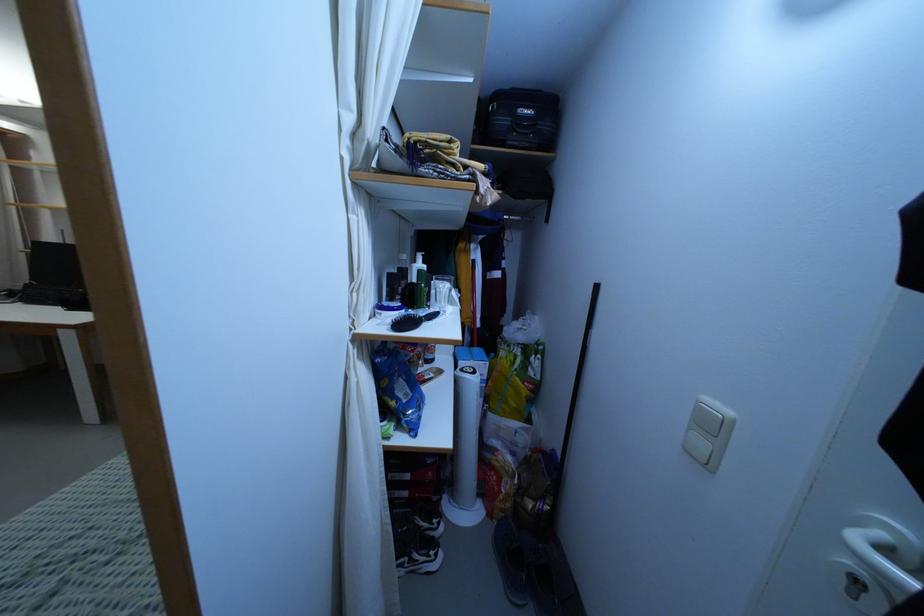
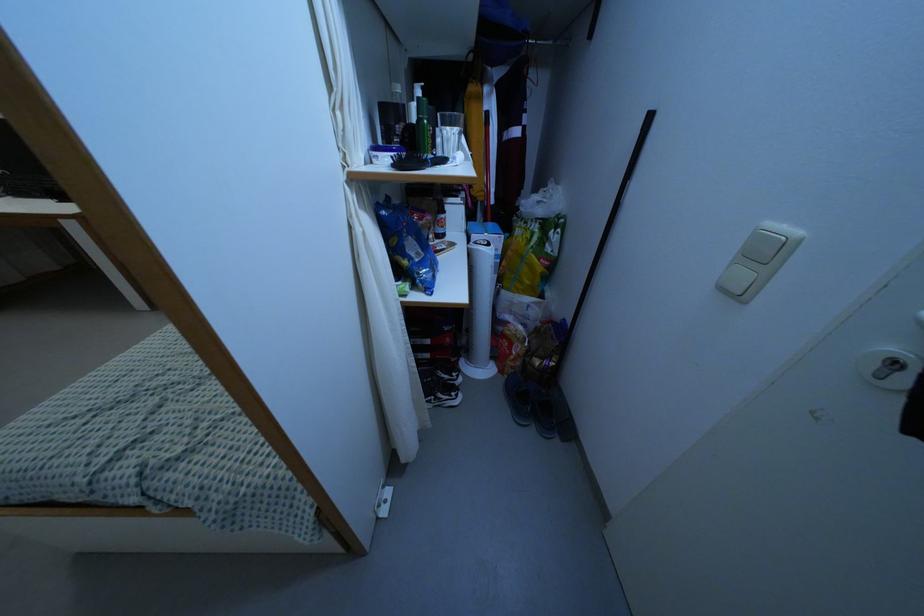
In the second image, find the point that corresponds to pixel 711 426 in the first image.

(762, 254)